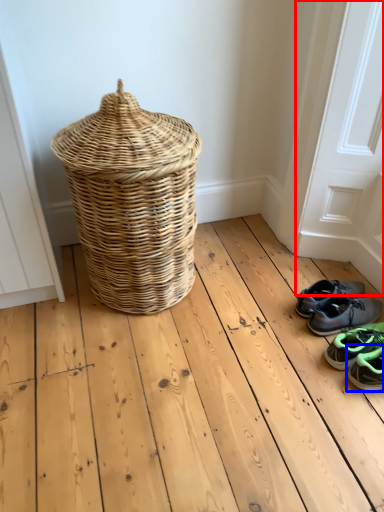
Question: Which object is further to the camera taking this photo, screen door (highlighted by a red box) or footwear (highlighted by a blue box)?

Choices:
 (A) screen door
 (B) footwear

Answer: (B)